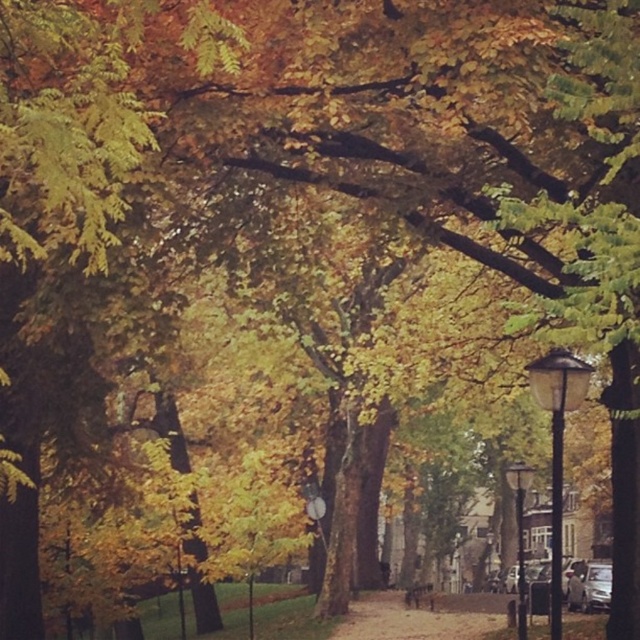
You are a delivery person carrying a box that is 3 meters long. You need to walk through the path between the matte black lamp post at center right and the matte black lamp post at right. Can you pass through without tilting the box?

The distance between the matte black lamp post at center right and the matte black lamp post at right is 4.70 meters. Since the box is 3 meters long, it can fit within the space as 4.70 meters is greater than 3 meters. Therefore, you can pass through without tilting the box.

You are standing on the pathway in the autumn scene. There are two points marked on the path. Which point is closer to you, point [560,580] or point [509,484]?

Point [560,580] is closer to the viewer than point [509,484].

You are a photographer standing at the start of the pathway and want to capture both the matte black lamp post at center right and the matte black lamp post at right in the same frame. Which lamp post should you position closer to the camera to ensure both are in focus?

To ensure both the matte black lamp post at center right and the matte black lamp post at right are in focus, you should position the matte black lamp post at center right closer to the camera since it is shorter than the matte black lamp post at right, allowing for a greater depth of field when focusing on both.